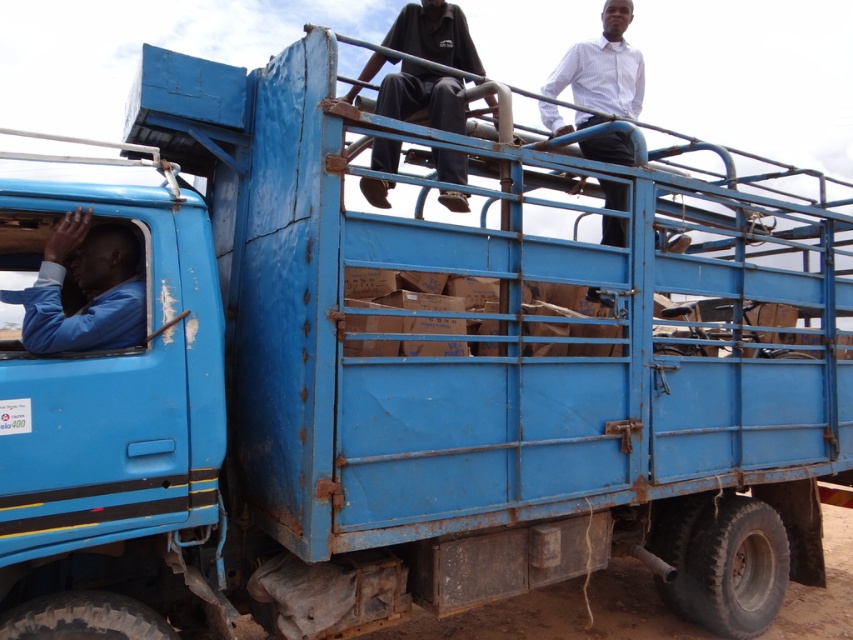
What is the color of the shirt worn by the person located at point (x=84, y=289)?

The point (x=84, y=289) marks the blue matte shirt at left, so the shirt is blue.

You are a delivery driver who needs to check the load on the truck bed. You see the blue matte shirt at left and the dark blue shirt at upper center. Which person is sitting lower in the truck bed?

The blue matte shirt at left is located below dark blue shirt at upper center, so the person wearing the blue matte shirt at left is sitting lower in the truck bed.